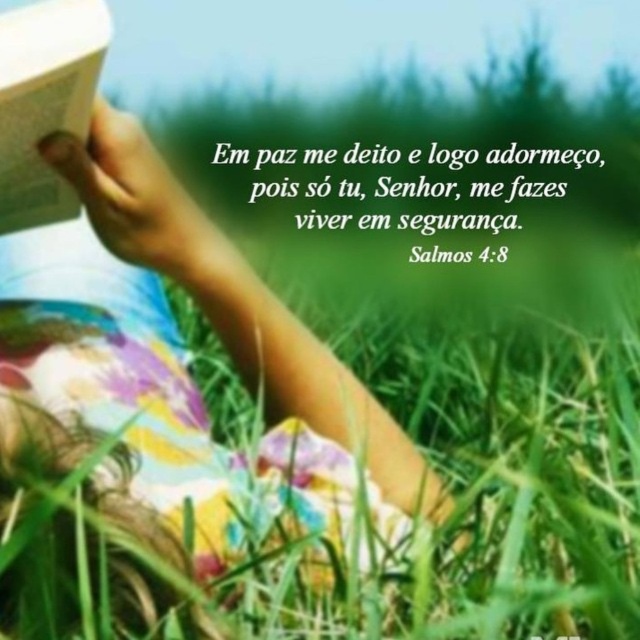
You are a photographer trying to capture the scene described. You need to ensure that both the green leafy text at center and the white paper book at upper left are clearly visible in your photo. Based on their positions, which object should you focus on first to ensure both are in focus?

The green leafy text at center is located above the white paper book at upper left. To ensure both are in focus, you should focus on the white paper book at upper left first, as it is closer to the camera, and the green leafy text at center will naturally fall into focus due to its position behind the book.

You are a photographer trying to capture the person in the scene. Since the pastel floral dress at center and the white paper book at upper left are both important elements, which object should you focus on first to ensure both are in clear view?

You should focus on the pastel floral dress at center first because it is in front of the white paper book at upper left. By focusing on the closer object, both will be in clear view as the background will still be relatively sharp.

You are a photographer trying to capture a person lying on the grass with their book. The person is wearing a pastel floral dress at center and holding a white paper book at upper left. Given that the dress is wider than the book, where should you position your camera to ensure both the dress and the book are fully visible in the frame?

Since the pastel floral dress at center is wider than the white paper book at upper left, position the camera so that the dress occupies the central area while leaving enough space on the sides to include the book at upper left. This ensures both objects are fully visible within the frame.